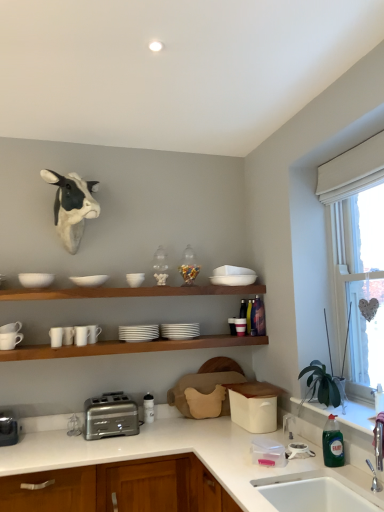
The height and width of the screenshot is (512, 384). What are the coordinates of `free space above clear glass window at right (from a real-world perspective)` in the screenshot? It's located at (354, 194).